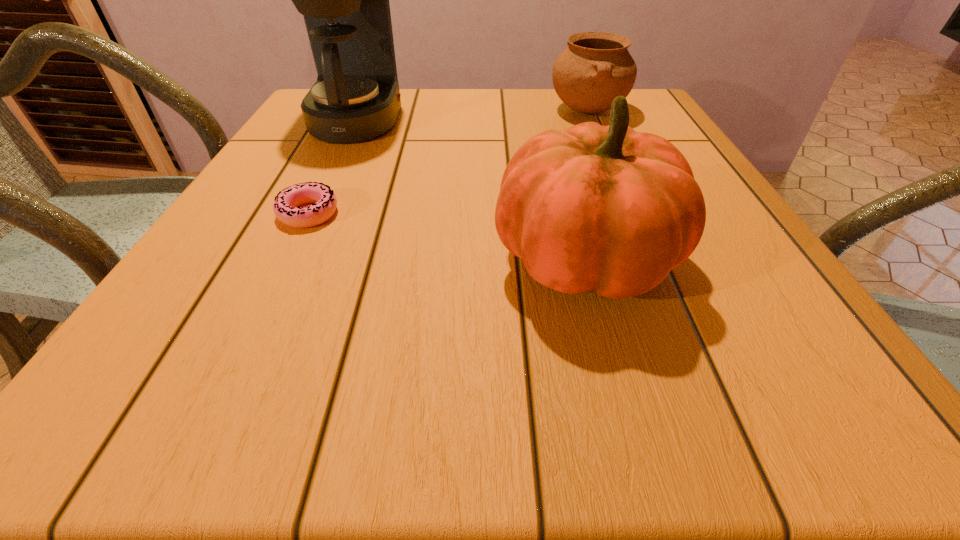
Where is `object that stands as the second closest to the pottery`? The width and height of the screenshot is (960, 540). object that stands as the second closest to the pottery is located at coordinates (354, 97).

Identify the location of free space that satisfies the following two spatial constraints: 1. on the back side of the pumpkin; 2. on the left side of the pottery. (544, 111).

You are a GUI agent. You are given a task and a screenshot of the screen. Output one action in this format:
    pyautogui.click(x=<x>, y=<y>)
    Task: Click on the free space that satisfies the following two spatial constraints: 1. on the button side of the pumpkin; 2. on the left side of the tallest object
    
    Given the screenshot: What is the action you would take?
    pyautogui.click(x=288, y=261)

At what (x,y) coordinates should I click in order to perform the action: click on vacant area in the image that satisfies the following two spatial constraints: 1. on the front side of the second tallest object; 2. on the left side of the shortest object. Please return your answer as a coordinate pair (x, y). The image size is (960, 540). Looking at the image, I should click on tap(285, 261).

Identify the location of free space that satisfies the following two spatial constraints: 1. on the back side of the pumpkin; 2. on the right side of the pottery. The image size is (960, 540). (544, 111).

You are a GUI agent. You are given a task and a screenshot of the screen. Output one action in this format:
    pyautogui.click(x=<x>, y=<y>)
    Task: Click on the free point that satisfies the following two spatial constraints: 1. on the back side of the shortest object; 2. on the right side of the third tallest object
    The image size is (960, 540).
    Given the screenshot: What is the action you would take?
    pyautogui.click(x=358, y=111)

You are a GUI agent. You are given a task and a screenshot of the screen. Output one action in this format:
    pyautogui.click(x=<x>, y=<y>)
    Task: Click on the free space that satisfies the following two spatial constraints: 1. on the back side of the pumpkin; 2. on the left side of the pottery
    Image resolution: width=960 pixels, height=540 pixels.
    Given the screenshot: What is the action you would take?
    pyautogui.click(x=544, y=111)

This screenshot has height=540, width=960. In order to click on free region that satisfies the following two spatial constraints: 1. on the button side of the coffee maker; 2. on the back side of the second tallest object in this screenshot , I will do `click(288, 261)`.